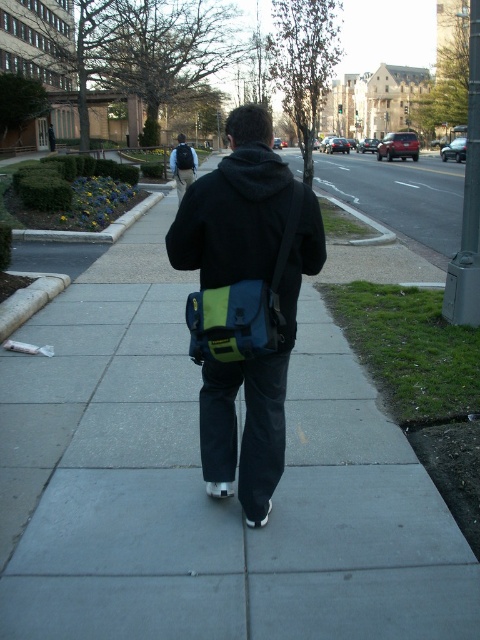
You are a delivery person who needs to choose a backpack to carry heavy packages. You see a matte black backpack at upper center and a matte blue backpack at center. Which backpack would be more suitable for carrying heavy items based on their sizes?

The matte black backpack at upper center is much taller than the matte blue backpack at center, so it would be more suitable for carrying heavy items as it likely has a larger capacity.

You are a delivery person who needs to place a package on the sidewalk between the matte black backpack at upper center and the matte blue backpack at center. The package is 1.5 meters long. Can you fit the package horizontally between them?

The distance between the matte black backpack at upper center and the matte blue backpack at center is 4.88 meters. Since the package is only 1.5 meters long, it can easily fit horizontally between them.